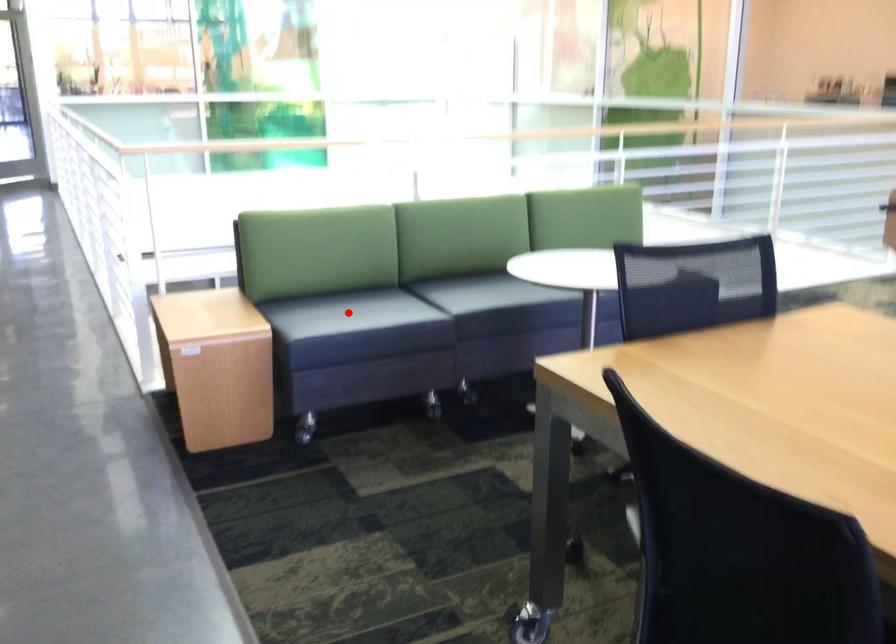
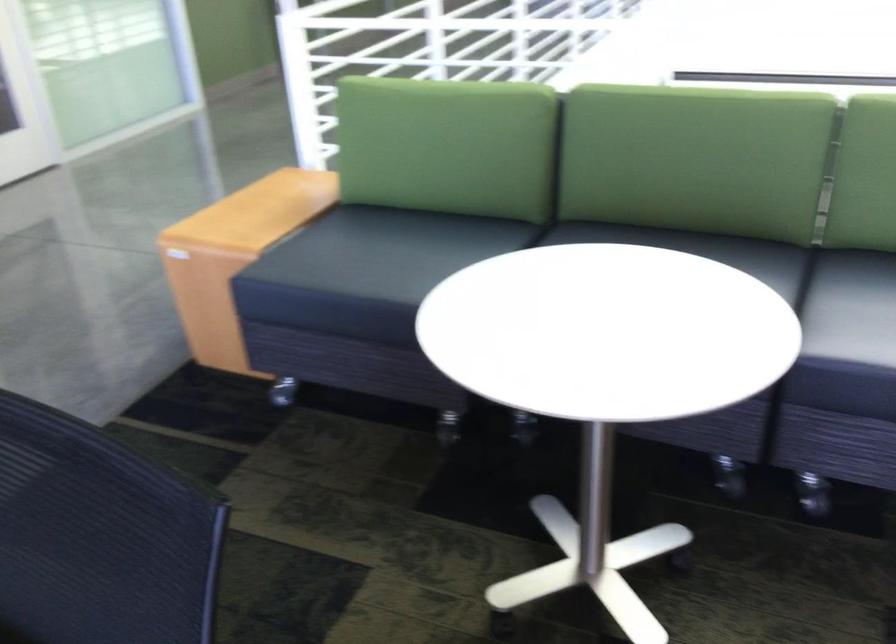
Find the pixel in the second image that matches the highlighted location in the first image.

(475, 278)